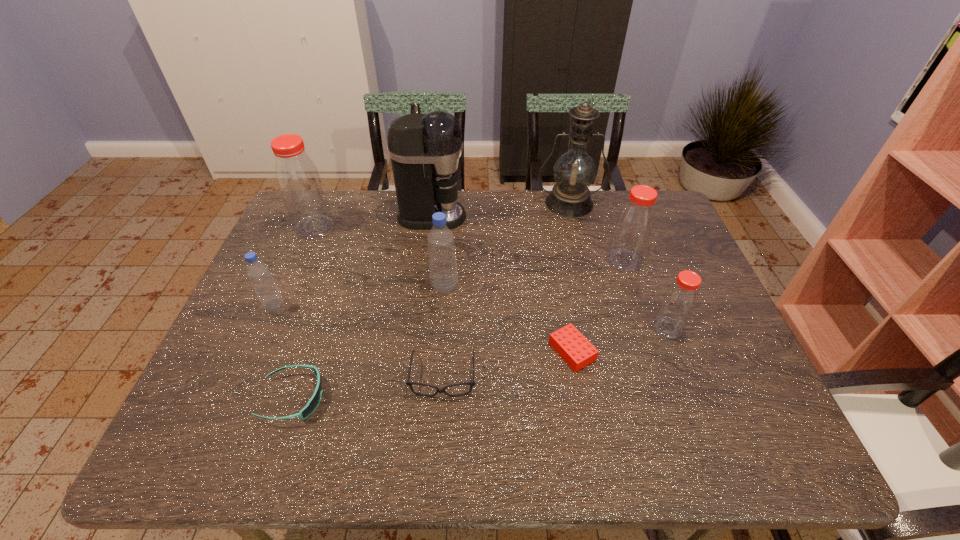
This screenshot has height=540, width=960. Find the location of `object at the far left corner`. object at the far left corner is located at coordinates 299,182.

In order to click on object present at the near left corner in this screenshot , I will do `click(313, 403)`.

Identify the location of vacant region at the far edge of the desktop. (517, 204).

In the image, there is a desktop. At what (x,y) coordinates should I click in order to perform the action: click on vacant space at the near edge. Please return your answer as a coordinate pair (x, y). The height and width of the screenshot is (540, 960). Looking at the image, I should click on (607, 450).

In the image, there is a desktop. Where is `vacant space at the left edge`? The height and width of the screenshot is (540, 960). vacant space at the left edge is located at coordinates (277, 286).

You are a GUI agent. You are given a task and a screenshot of the screen. Output one action in this format:
    pyautogui.click(x=<x>, y=<y>)
    Task: Click on the free point at the right edge
    This screenshot has width=960, height=540.
    Given the screenshot: What is the action you would take?
    pyautogui.click(x=679, y=246)

The height and width of the screenshot is (540, 960). In the image, there is a desktop. What are the coordinates of `vacant space at the far left corner` in the screenshot? It's located at (332, 193).

Image resolution: width=960 pixels, height=540 pixels. Find the location of `empty location between the gray oil lamp and the coffee maker`. empty location between the gray oil lamp and the coffee maker is located at coordinates (500, 210).

Locate an element on the screen. This screenshot has width=960, height=540. vacant area that lies between the nearest red bottle and the sunglasses is located at coordinates (480, 363).

Where is `free space between the smaller blue bottle and the nearest red bottle`? free space between the smaller blue bottle and the nearest red bottle is located at coordinates (470, 317).